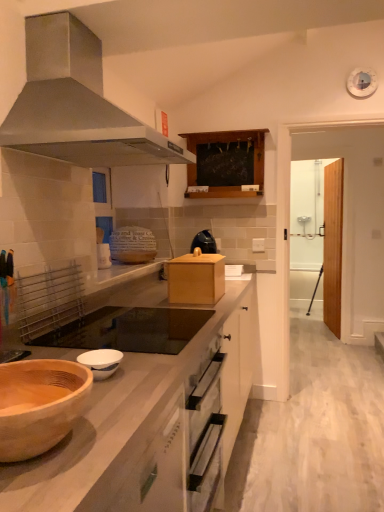
Question: From the image's perspective, is wooden at left under black glass gas stove at center?

Choices:
 (A) no
 (B) yes

Answer: (B)

Question: Is wooden at left facing away from black glass gas stove at center?

Choices:
 (A) yes
 (B) no

Answer: (B)

Question: From a real-world perspective, is wooden at left under black glass gas stove at center?

Choices:
 (A) yes
 (B) no

Answer: (A)

Question: Is wooden at left with black glass gas stove at center?

Choices:
 (A) yes
 (B) no

Answer: (B)

Question: Can you confirm if wooden at left is positioned to the left of black glass gas stove at center?

Choices:
 (A) no
 (B) yes

Answer: (A)

Question: Looking at their shapes, would you say transparent glass door at right, the first glass door viewed from the left, is wider or thinner than metallic stainless steel range hood at upper left?

Choices:
 (A) wide
 (B) thin

Answer: (B)

Question: Is transparent glass door at right, the first glass door viewed from the left, taller or shorter than metallic stainless steel range hood at upper left?

Choices:
 (A) tall
 (B) short

Answer: (A)

Question: Would you say transparent glass door at right, the 2th glass door viewed from the right, is inside or outside metallic stainless steel range hood at upper left?

Choices:
 (A) inside
 (B) outside

Answer: (B)

Question: Relative to metallic stainless steel range hood at upper left, is transparent glass door at right, the 2th glass door viewed from the right, in front or behind?

Choices:
 (A) front
 (B) behind

Answer: (B)

Question: From the image's perspective, relative to black glass gas stove at center, is transparent glass door at right, the first glass door viewed from the left, above or below?

Choices:
 (A) above
 (B) below

Answer: (A)

Question: Is transparent glass door at right, the first glass door viewed from the left, situated inside black glass gas stove at center or outside?

Choices:
 (A) outside
 (B) inside

Answer: (A)

Question: In the image, is transparent glass door at right, the first glass door viewed from the left, on the left side or the right side of black glass gas stove at center?

Choices:
 (A) right
 (B) left

Answer: (A)

Question: Is point (301, 260) closer or farther from the camera than point (147, 339)?

Choices:
 (A) closer
 (B) farther

Answer: (B)

Question: Considering the positions of point (195, 150) and point (327, 248), is point (195, 150) closer or farther from the camera than point (327, 248)?

Choices:
 (A) closer
 (B) farther

Answer: (A)

Question: Is wooden cabinet at upper center wider or thinner than transparent glass door at right, the first glass door viewed from the left?

Choices:
 (A) wide
 (B) thin

Answer: (A)